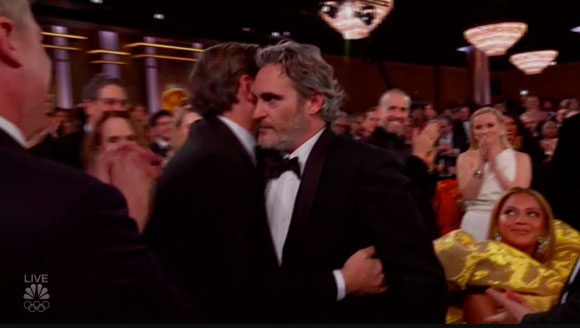
Locate an element on the screen. The height and width of the screenshot is (328, 580). black ceiling is located at coordinates (203, 4), (452, 20), (409, 47), (404, 11), (527, 8).